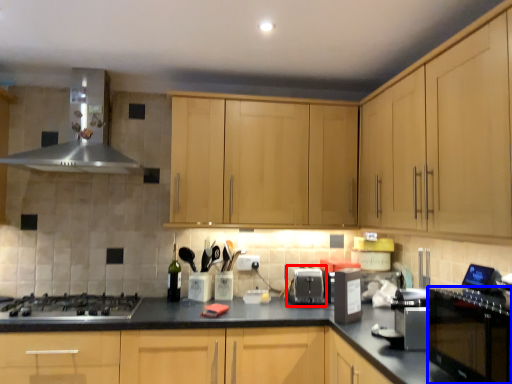
Question: Which point is closer to the camera, appliance (highlighted by a red box) or oven (highlighted by a blue box)?

Choices:
 (A) appliance
 (B) oven

Answer: (B)